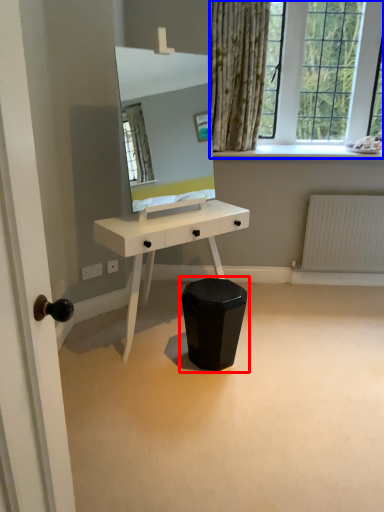
Question: Which object is further to the camera taking this photo, swivel chair (highlighted by a red box) or window (highlighted by a blue box)?

Choices:
 (A) swivel chair
 (B) window

Answer: (B)